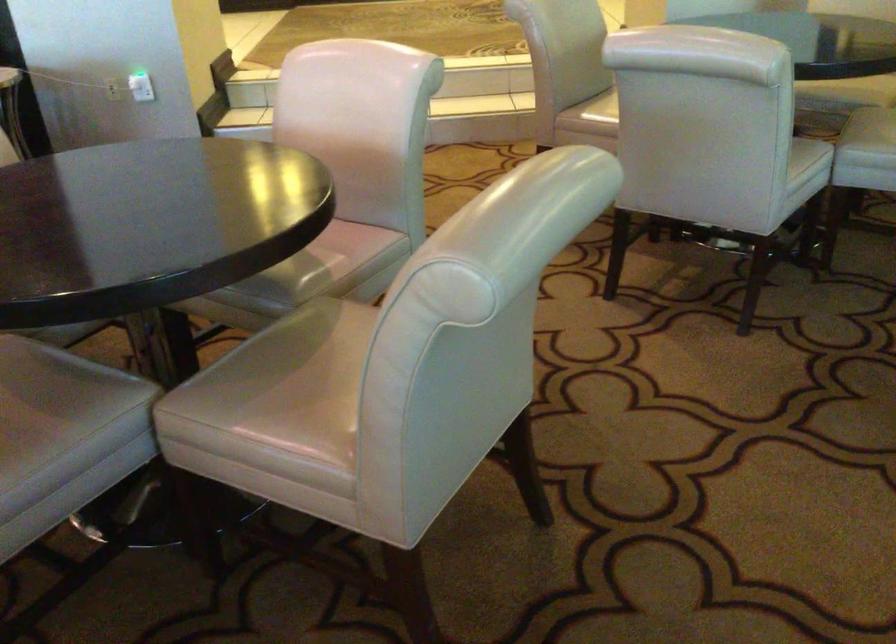
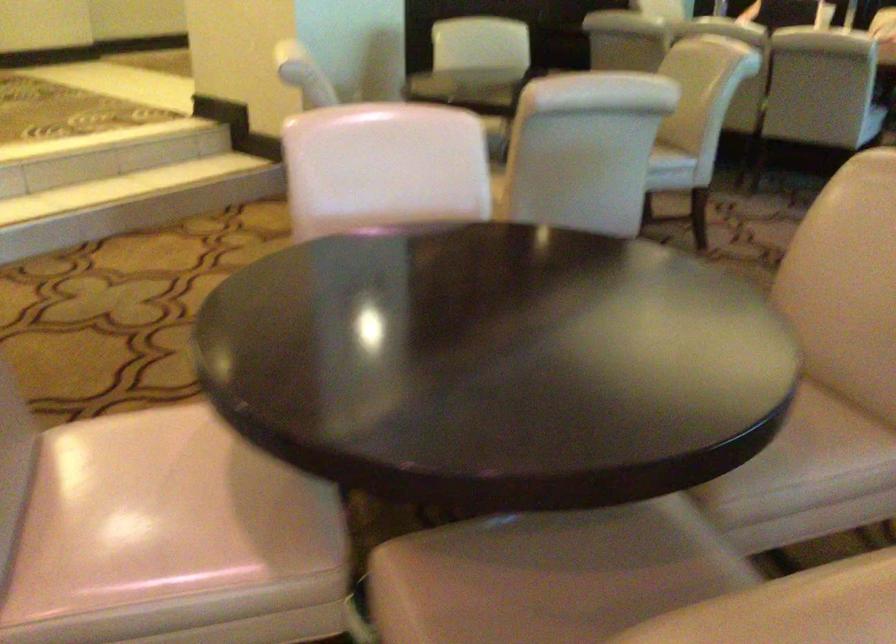
The point at (325, 413) is marked in the first image. Where is the corresponding point in the second image?

(814, 424)